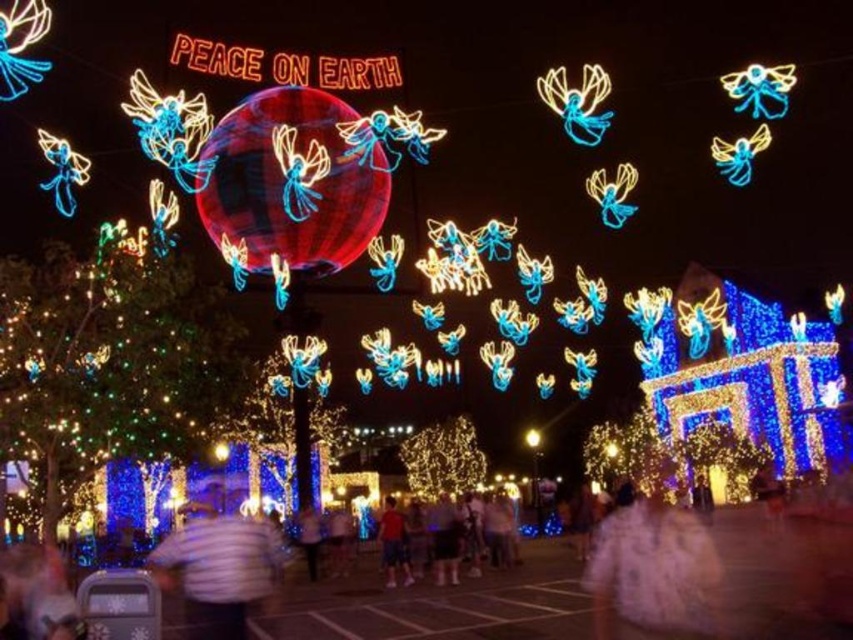
Which is above, white striped shirt at center or matte red shirt at center?

white striped shirt at center is above.

Looking at this image, is white striped shirt at center thinner than matte red shirt at center?

Incorrect, white striped shirt at center's width is not less than matte red shirt at center's.

Who is more distant from viewer, (230,538) or (387,502)?

Positioned behind is point (387,502).

The image size is (853, 640). What are the coordinates of `white striped shirt at center` in the screenshot? It's located at (218, 564).